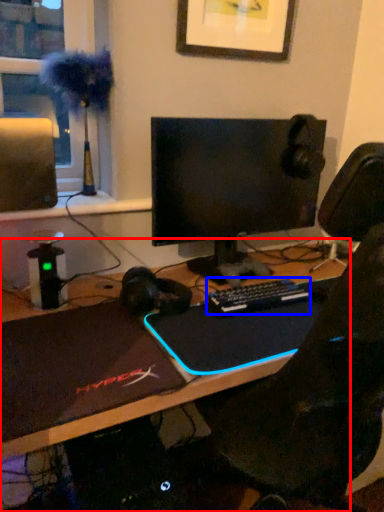
Question: Which object appears closest to the camera in this image, desk (highlighted by a red box) or computer keyboard (highlighted by a blue box)?

Choices:
 (A) desk
 (B) computer keyboard

Answer: (A)